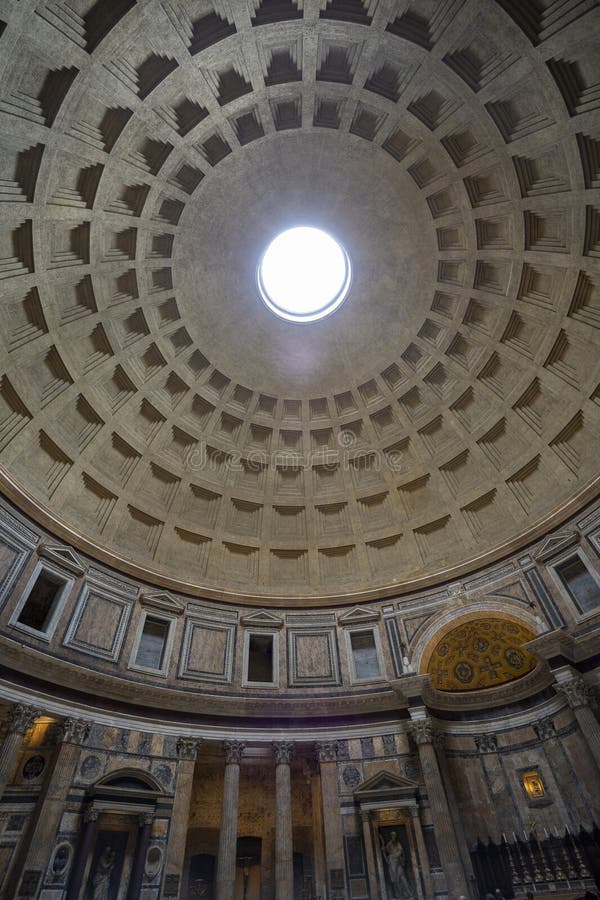
The width and height of the screenshot is (600, 900). Identify the location of artificial light. click(x=35, y=736), click(x=537, y=788).